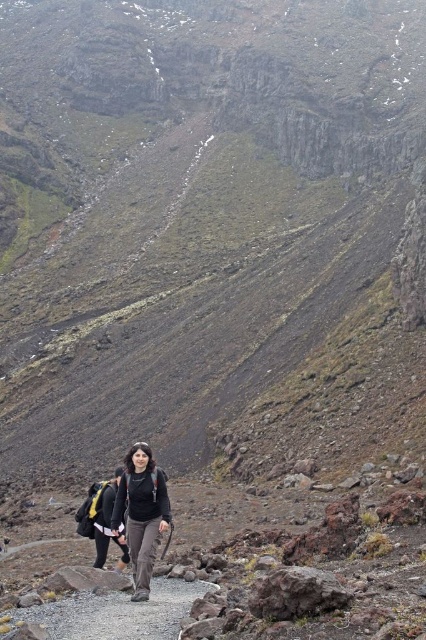
Between gray gravel path at center and matte black backpack at center, which one is positioned higher?

matte black backpack at center

Can you confirm if gray gravel path at center is thinner than matte black backpack at center?

In fact, gray gravel path at center might be wider than matte black backpack at center.

Does point (127, 604) come farther from viewer compared to point (144, 497)?

No, it is not.

What are the coordinates of `gray gravel path at center` in the screenshot? It's located at 117,612.